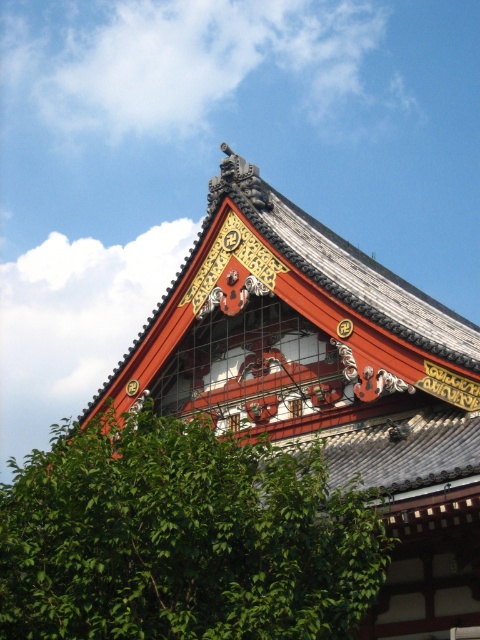
Question: Which of the following is the closest to the observer?

Choices:
 (A) green leafy tree at lower left
 (B) shiny red wood roof at upper center

Answer: (A)

Question: Which point is closer to the camera?

Choices:
 (A) shiny red wood roof at upper center
 (B) green leafy tree at lower left

Answer: (B)

Question: Can you confirm if green leafy tree at lower left is positioned below shiny red wood roof at upper center?

Choices:
 (A) yes
 (B) no

Answer: (A)

Question: Is green leafy tree at lower left above shiny red wood roof at upper center?

Choices:
 (A) yes
 (B) no

Answer: (B)

Question: Can you confirm if green leafy tree at lower left is thinner than shiny red wood roof at upper center?

Choices:
 (A) yes
 (B) no

Answer: (B)